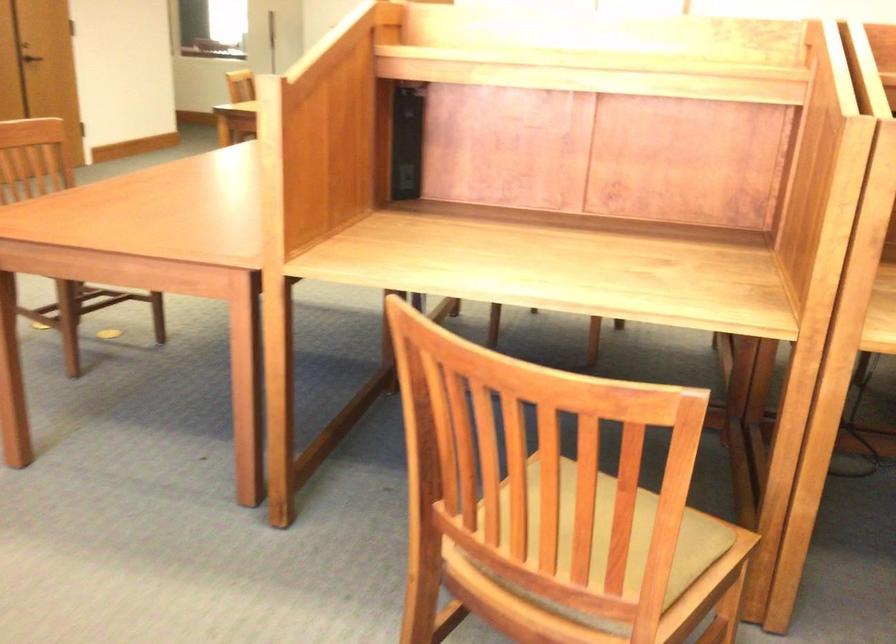
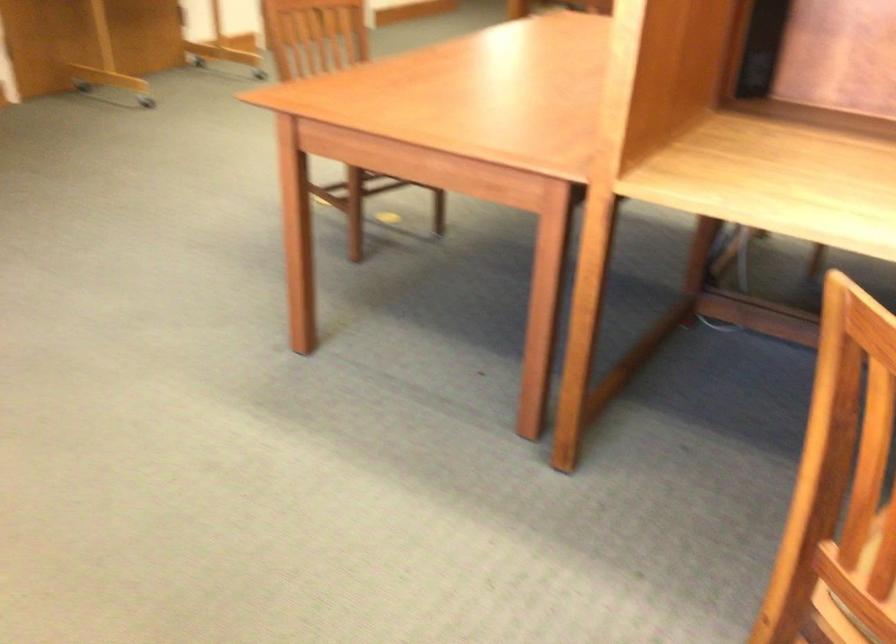
In a continuous first-person perspective shot, in which direction is the camera moving?

The cameraman walked toward left, forward.